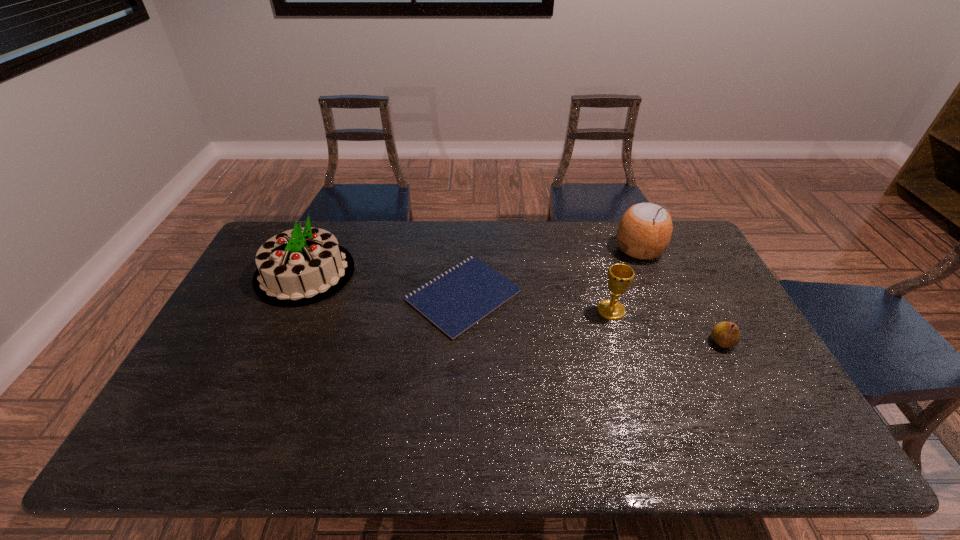
What are the coordinates of `free space at the far edge of the desktop` in the screenshot? It's located at (510, 233).

In the image, there is a desktop. Identify the location of vacant region at the near edge. The height and width of the screenshot is (540, 960). (671, 446).

Identify the location of vacant region at the left edge of the desktop. (255, 322).

Find the location of a particular element. The width and height of the screenshot is (960, 540). vacant space at the right edge is located at coordinates (742, 350).

The width and height of the screenshot is (960, 540). I want to click on free region at the far right corner, so click(x=674, y=225).

Where is `vacant area between the pear and the third object from left to right`? The image size is (960, 540). vacant area between the pear and the third object from left to right is located at coordinates point(666,326).

Where is `vacant space that is in between the birthday cake and the fourth object from right to left`? vacant space that is in between the birthday cake and the fourth object from right to left is located at coordinates (384, 284).

I want to click on empty space that is in between the fourth object from right to left and the pear, so click(592, 319).

Locate an element on the screen. The height and width of the screenshot is (540, 960). free area in between the coconut and the pear is located at coordinates (681, 295).

The width and height of the screenshot is (960, 540). I want to click on vacant region between the third object from left to right and the shortest object, so click(538, 303).